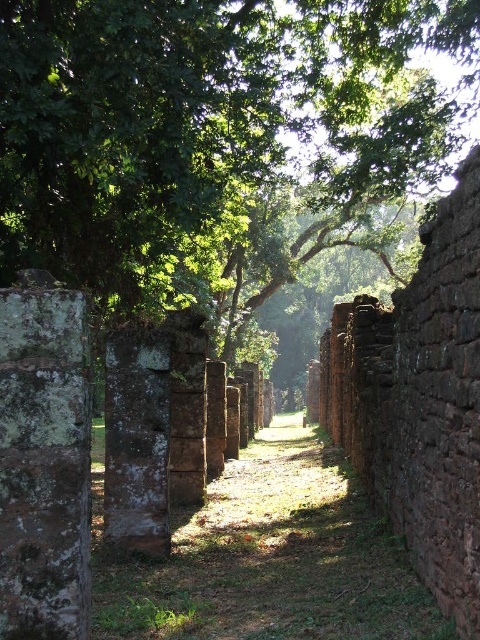
Question: Is green leafy tree at center wider than rusty stone pillar at center?

Choices:
 (A) no
 (B) yes

Answer: (A)

Question: Does green leafy tree at center come in front of rusty stone pillar at center?

Choices:
 (A) no
 (B) yes

Answer: (B)

Question: Among these objects, which one is farthest from the camera?

Choices:
 (A) green leafy tree at center
 (B) rusty stone pillar at center

Answer: (B)

Question: Can you confirm if green leafy tree at center is positioned below rusty stone pillar at center?

Choices:
 (A) yes
 (B) no

Answer: (B)